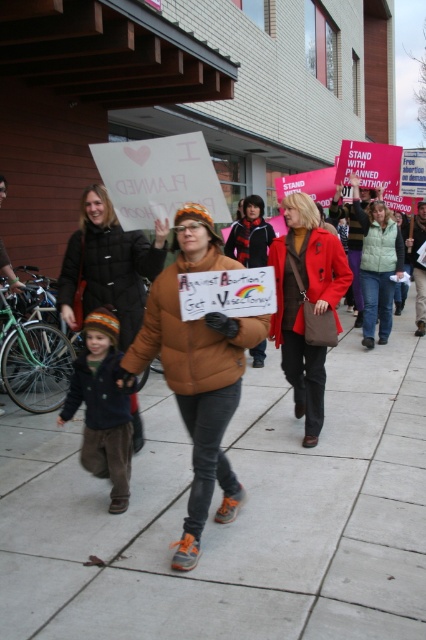
Between matte brown coat at center and knitted wool hat at center, which one appears on the right side from the viewer's perspective?

From the viewer's perspective, matte brown coat at center appears more on the right side.

Is matte brown coat at center wider than knitted wool hat at center?

Correct, the width of matte brown coat at center exceeds that of knitted wool hat at center.

This screenshot has width=426, height=640. What do you see at coordinates (304, 301) in the screenshot?
I see `matte brown coat at center` at bounding box center [304, 301].

Identify the location of matte brown coat at center. (304, 301).

This screenshot has width=426, height=640. What do you see at coordinates (236, 516) in the screenshot? I see `gray concrete sidewalk at center` at bounding box center [236, 516].

Which is behind, point (207, 592) or point (88, 436)?

The point (88, 436) is more distant.

At what (x,y) coordinates should I click in order to perform the action: click on gray concrete sidewalk at center. Please return your answer as a coordinate pair (x, y). This screenshot has width=426, height=640. Looking at the image, I should click on (236, 516).

Is gray concrete sidewalk at center taller than brown puffy jacket at center?

Incorrect, gray concrete sidewalk at center's height is not larger of brown puffy jacket at center's.

How far apart are gray concrete sidewalk at center and brown puffy jacket at center?

gray concrete sidewalk at center and brown puffy jacket at center are 97.86 centimeters apart from each other.

Which is in front, point (386, 392) or point (121, 378)?

Point (121, 378)

The height and width of the screenshot is (640, 426). In order to click on gray concrete sidewalk at center in this screenshot , I will do `click(236, 516)`.